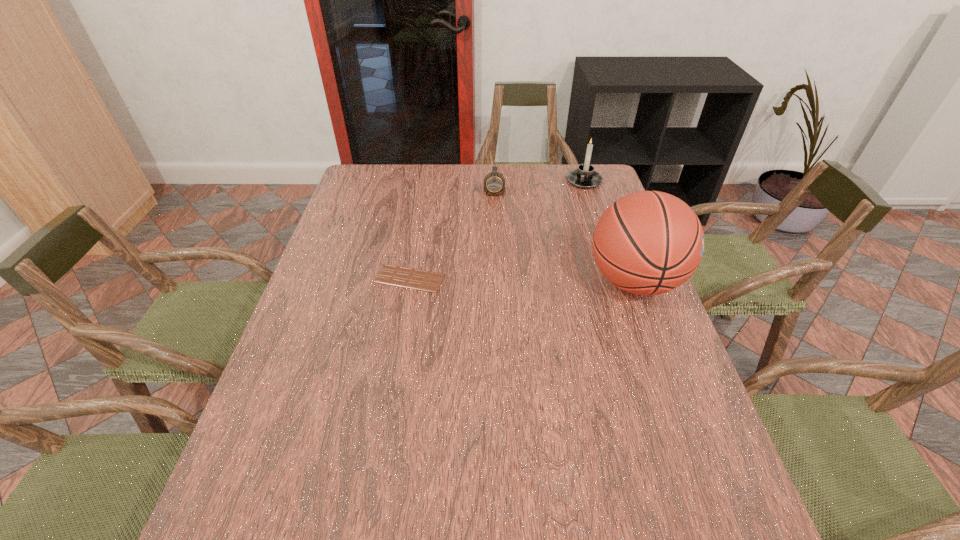
I want to click on free spot on the desktop that is between the chocolate bar and the basketball and is positioned with a handle on the side of the candle holder, so click(535, 280).

You are a GUI agent. You are given a task and a screenshot of the screen. Output one action in this format:
    pyautogui.click(x=<x>, y=<y>)
    Task: Click on the vacant space on the desktop that is between the chocolate bar and the basketball and is positioned on the face of the third object from right to left
    This screenshot has height=540, width=960.
    Given the screenshot: What is the action you would take?
    pos(493,279)